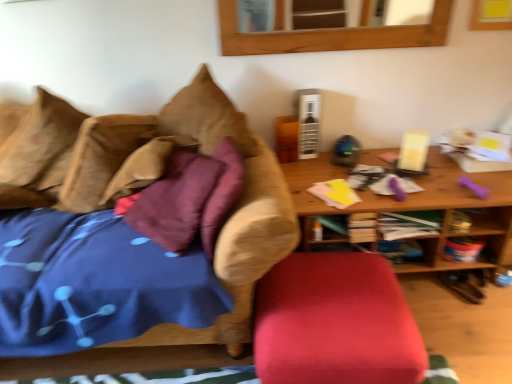
Question: Does brown suede pillow at upper left, marked as the 1th pillow in a right-to-left arrangement, have a greater width compared to brown fabric couch at left?

Choices:
 (A) no
 (B) yes

Answer: (A)

Question: Is brown suede pillow at upper left, marked as the 1th pillow in a right-to-left arrangement, thinner than brown fabric couch at left?

Choices:
 (A) no
 (B) yes

Answer: (B)

Question: Is brown suede pillow at upper left, which is counted as the 2th pillow, starting from the left, turned away from brown fabric couch at left?

Choices:
 (A) yes
 (B) no

Answer: (A)

Question: Does brown suede pillow at upper left, which is counted as the 2th pillow, starting from the left, appear on the right side of brown fabric couch at left?

Choices:
 (A) yes
 (B) no

Answer: (A)

Question: Does brown suede pillow at upper left, marked as the 1th pillow in a right-to-left arrangement, have a greater height compared to brown fabric couch at left?

Choices:
 (A) no
 (B) yes

Answer: (A)

Question: Can we say brown suede pillow at upper left, marked as the 1th pillow in a right-to-left arrangement, lies outside brown fabric couch at left?

Choices:
 (A) no
 (B) yes

Answer: (A)

Question: From a real-world perspective, is brown textured pillow at left, the second pillow from the right, over brown suede pillow at upper left, which is counted as the 2th pillow, starting from the left?

Choices:
 (A) no
 (B) yes

Answer: (B)

Question: Is brown textured pillow at left, the second pillow from the right, to the right of brown suede pillow at upper left, which is counted as the 2th pillow, starting from the left, from the viewer's perspective?

Choices:
 (A) no
 (B) yes

Answer: (A)

Question: Can you confirm if brown textured pillow at left, the second pillow from the right, is taller than brown suede pillow at upper left, marked as the 1th pillow in a right-to-left arrangement?

Choices:
 (A) no
 (B) yes

Answer: (B)

Question: Is brown textured pillow at left, which appears as the first pillow when viewed from the left, far away from brown suede pillow at upper left, marked as the 1th pillow in a right-to-left arrangement?

Choices:
 (A) no
 (B) yes

Answer: (A)

Question: Considering the relative sizes of brown textured pillow at left, which appears as the first pillow when viewed from the left, and brown suede pillow at upper left, which is counted as the 2th pillow, starting from the left, in the image provided, is brown textured pillow at left, which appears as the first pillow when viewed from the left, bigger than brown suede pillow at upper left, which is counted as the 2th pillow, starting from the left,?

Choices:
 (A) no
 (B) yes

Answer: (A)

Question: Is brown textured pillow at left, the second pillow from the right, closer to the viewer compared to brown suede pillow at upper left, which is counted as the 2th pillow, starting from the left?

Choices:
 (A) yes
 (B) no

Answer: (B)

Question: Does brown fabric couch at left appear on the left side of wooden table at right?

Choices:
 (A) no
 (B) yes

Answer: (B)